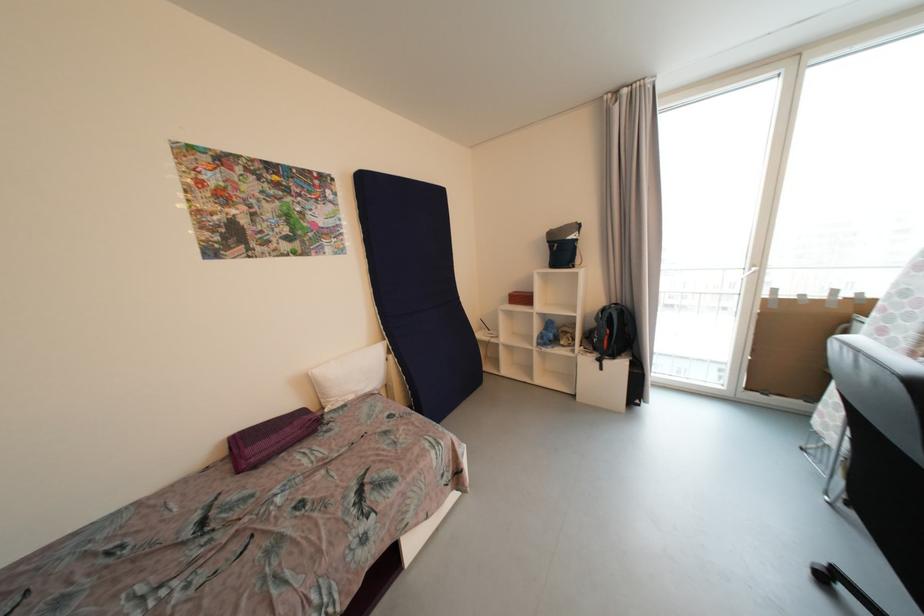
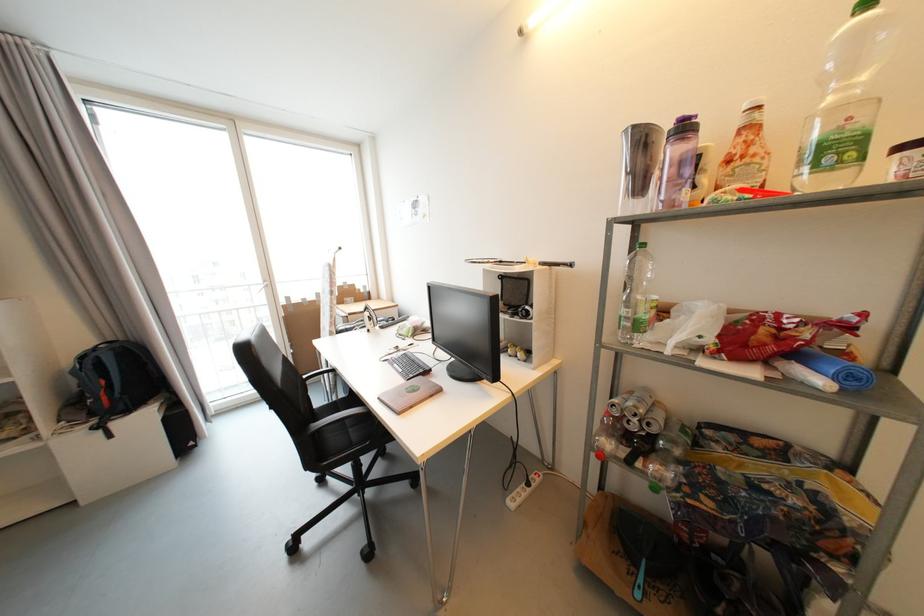
Locate, in the second image, the point that corresponds to the point at 604,362 in the first image.

(104, 429)